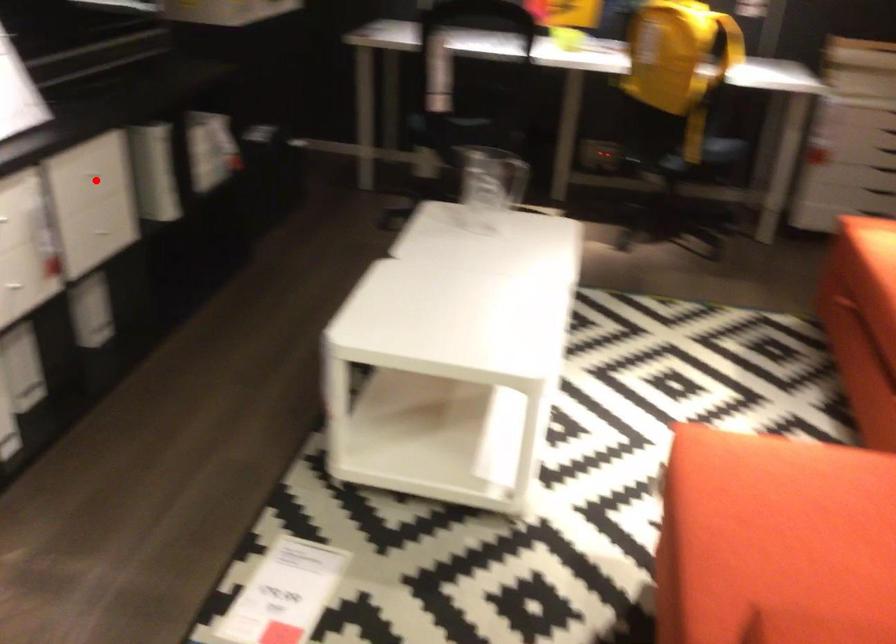
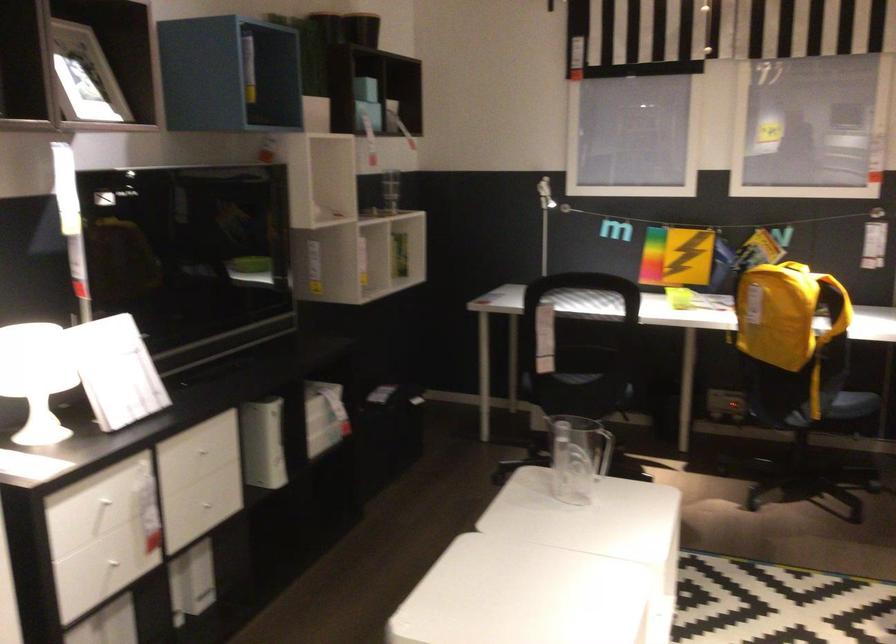
In the second image, find the point that corresponds to the highlighted location in the first image.

(203, 457)